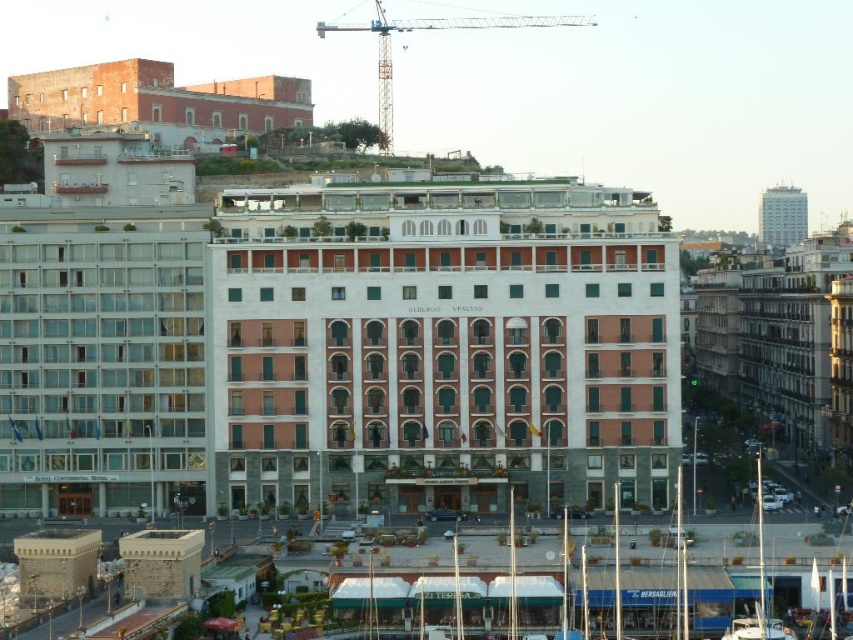
Who is higher up, red brick building at center or brick wall building at upper left?

brick wall building at upper left is higher up.

This screenshot has width=853, height=640. I want to click on red brick building at center, so click(x=440, y=344).

Between point (645, 208) and point (158, 65), which one is positioned in front?

Point (645, 208) is in front.

Image resolution: width=853 pixels, height=640 pixels. I want to click on red brick building at center, so click(x=440, y=344).

Can you confirm if metallic construction crane at upper center is shorter than white plastic boat at lower right?

No, metallic construction crane at upper center is not shorter than white plastic boat at lower right.

Identify the location of metallic construction crane at upper center. (425, 29).

The image size is (853, 640). Describe the element at coordinates (425, 29) in the screenshot. I see `metallic construction crane at upper center` at that location.

At what (x,y) coordinates should I click in order to perform the action: click on metallic construction crane at upper center. Please return your answer as a coordinate pair (x, y). Looking at the image, I should click on (425, 29).

From the picture: Who is lower down, matte glass windows at left or brick wall building at upper left?

matte glass windows at left

Between matte glass windows at left and brick wall building at upper left, which one is positioned higher?

Positioned higher is brick wall building at upper left.

Is point (56, 294) farther from viewer compared to point (132, 61)?

No, (56, 294) is closer to viewer.

Identify the location of matte glass windows at left. Image resolution: width=853 pixels, height=640 pixels. (102, 358).